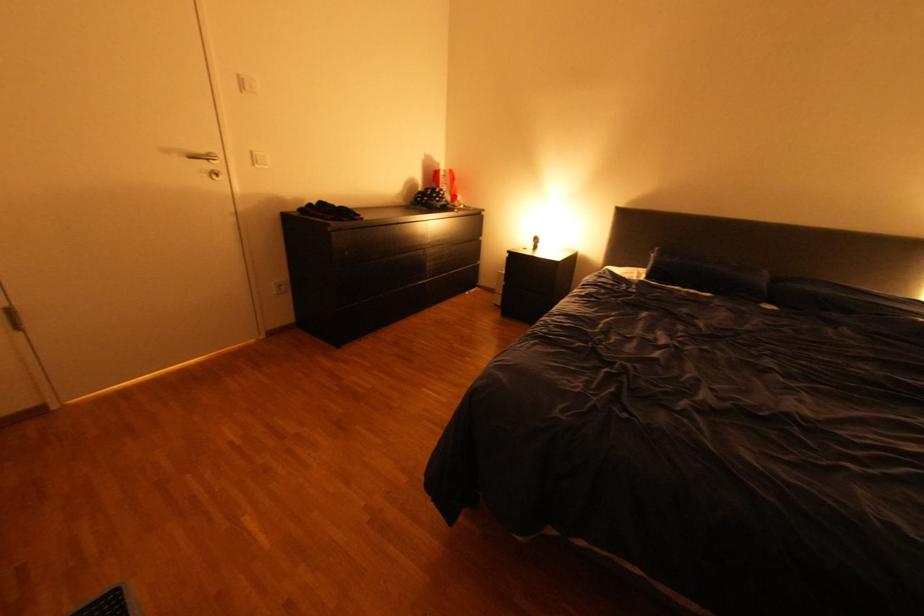
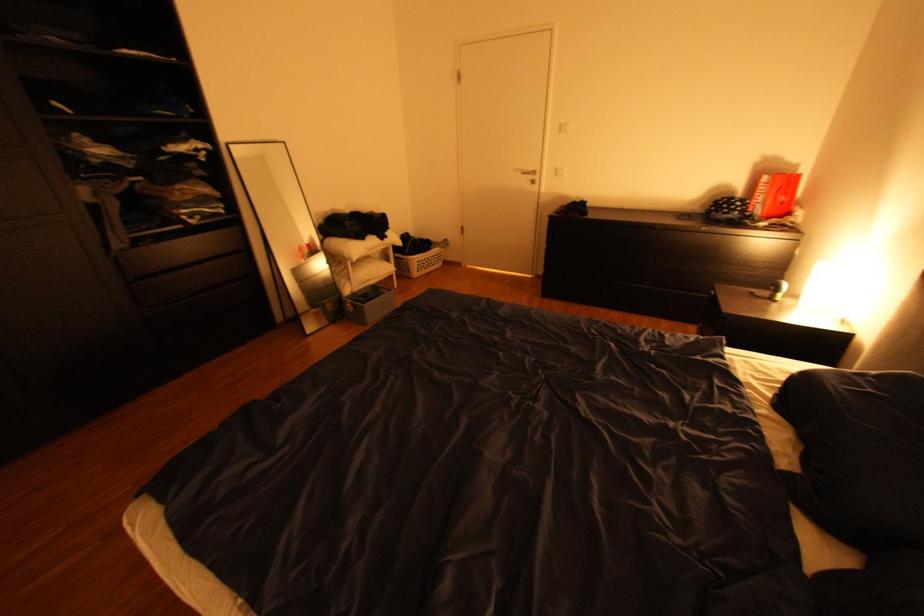
Question: I am providing you with two images of the same scene from different viewpoints. A red point is shown in image1. For the corresponding object point in image2, is it positioned nearer or farther from the camera?

Choices:
 (A) Nearer
 (B) Farther

Answer: (B)